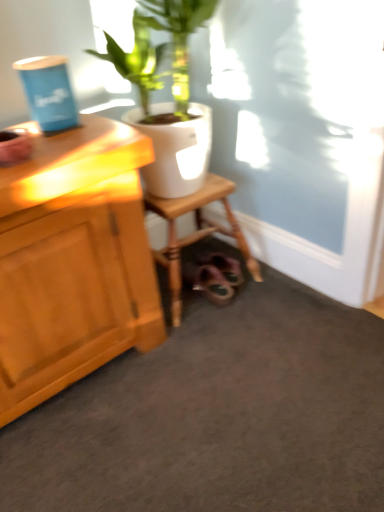
Question: Can you confirm if wooden stool at lower center is shorter than white glossy pot at upper center?

Choices:
 (A) no
 (B) yes

Answer: (B)

Question: From a real-world perspective, is wooden stool at lower center located higher than white glossy pot at upper center?

Choices:
 (A) yes
 (B) no

Answer: (B)

Question: Is wooden stool at lower center next to white glossy pot at upper center and touching it?

Choices:
 (A) no
 (B) yes

Answer: (A)

Question: Can you confirm if wooden stool at lower center is positioned to the right of white glossy pot at upper center?

Choices:
 (A) no
 (B) yes

Answer: (A)

Question: Considering the relative sizes of wooden stool at lower center and white glossy pot at upper center in the image provided, is wooden stool at lower center taller than white glossy pot at upper center?

Choices:
 (A) yes
 (B) no

Answer: (B)

Question: Is wooden stool at lower center at the left side of white glossy pot at upper center?

Choices:
 (A) yes
 (B) no

Answer: (A)

Question: From the image's perspective, is white glossy pot at upper center on wooden stool at lower center?

Choices:
 (A) no
 (B) yes

Answer: (B)

Question: Are white glossy pot at upper center and wooden stool at lower center making contact?

Choices:
 (A) yes
 (B) no

Answer: (B)

Question: Is white glossy pot at upper center outside wooden stool at lower center?

Choices:
 (A) no
 (B) yes

Answer: (B)

Question: Does white glossy pot at upper center have a larger size compared to wooden stool at lower center?

Choices:
 (A) no
 (B) yes

Answer: (B)

Question: Is the depth of white glossy pot at upper center greater than that of wooden stool at lower center?

Choices:
 (A) no
 (B) yes

Answer: (A)

Question: From a real-world perspective, is white glossy pot at upper center under wooden stool at lower center?

Choices:
 (A) no
 (B) yes

Answer: (A)

Question: Is white glossy pot at upper center in front of or behind wooden stool at lower center in the image?

Choices:
 (A) front
 (B) behind

Answer: (A)